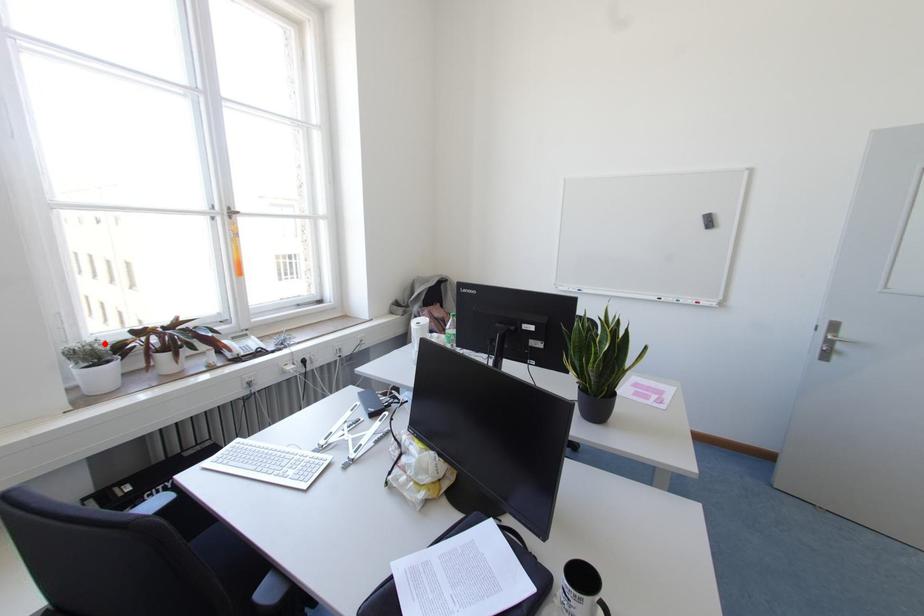
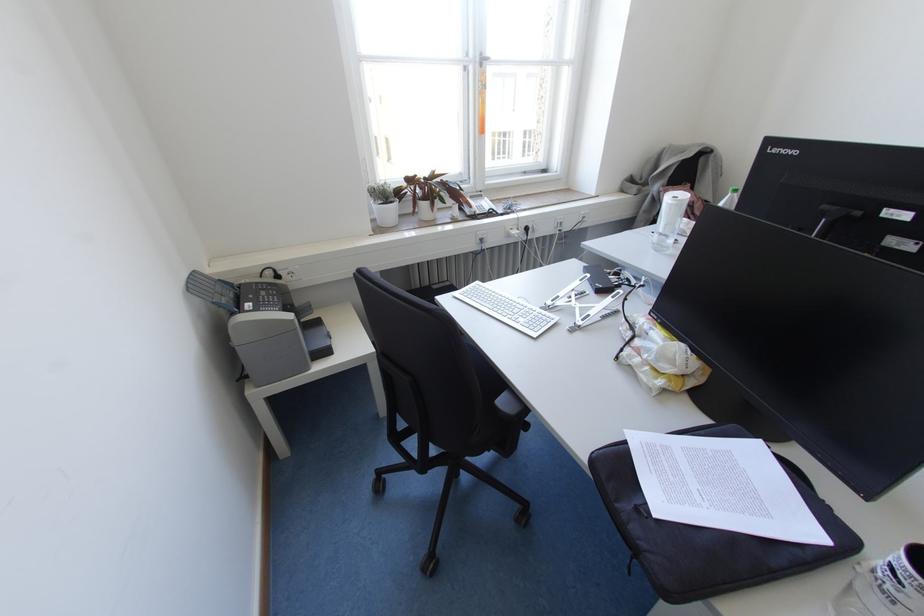
Where in the second image is the point corresponding to the highlighted location from the first image?

(390, 187)